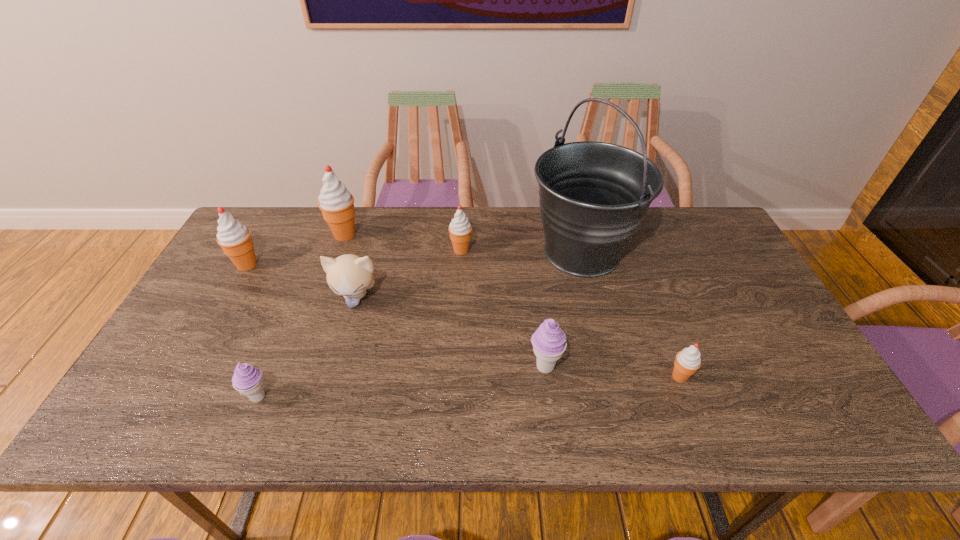
Where is `kitten`? The height and width of the screenshot is (540, 960). kitten is located at coordinates (348, 275).

The image size is (960, 540). Identify the location of the rightmost red icecream. (688, 361).

At what (x,y) coordinates should I click in order to perform the action: click on the nearest red icecream. Please return your answer as a coordinate pair (x, y). Looking at the image, I should click on (688, 361).

The width and height of the screenshot is (960, 540). I want to click on the smaller purple icecream, so coord(247,379).

Image resolution: width=960 pixels, height=540 pixels. I want to click on the nearer purple icecream, so click(247, 379).

You are a GUI agent. You are given a task and a screenshot of the screen. Output one action in this format:
    pyautogui.click(x=<x>, y=<y>)
    Task: Click on the free region located on the left of the bucket
    
    Given the screenshot: What is the action you would take?
    431,252

In order to click on vacant space positioned 0.170m on the right of the second red icecream from left to right in this screenshot , I will do `click(414, 234)`.

Where is `vacant area situated 0.280m on the right of the leftmost object`? The image size is (960, 540). vacant area situated 0.280m on the right of the leftmost object is located at coordinates (354, 265).

You are a GUI agent. You are given a task and a screenshot of the screen. Output one action in this format:
    pyautogui.click(x=<x>, y=<y>)
    Task: Click on the free space located on the back of the second smallest red icecream
    Image resolution: width=960 pixels, height=540 pixels.
    Given the screenshot: What is the action you would take?
    pyautogui.click(x=463, y=226)

Locate an element on the screen. The width and height of the screenshot is (960, 540). vacant space located on the left of the farther purple icecream is located at coordinates (487, 367).